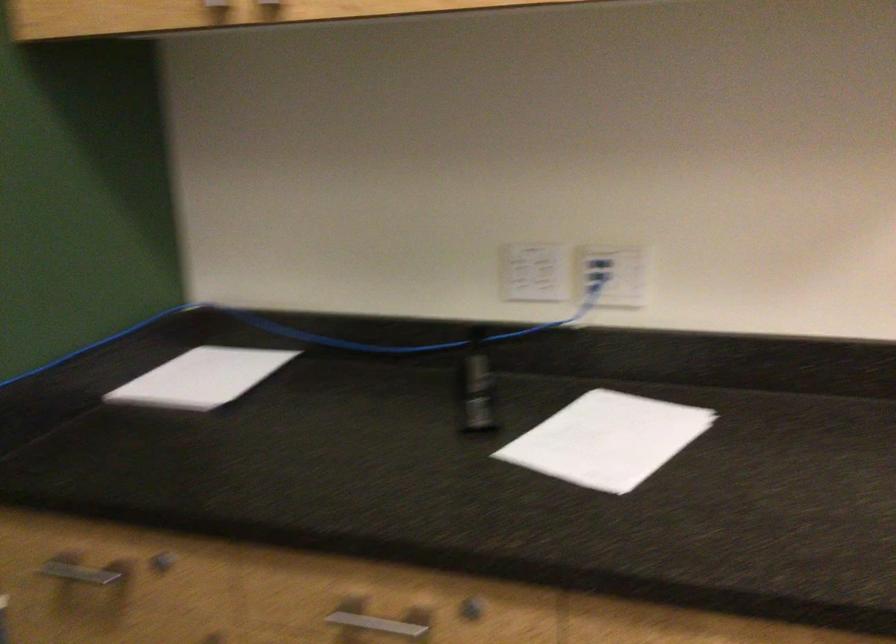
In the scene shown: The first image is from the beginning of the video and the second image is from the end. How did the camera likely rotate when shooting the video?

The rotation direction of the camera is right-down.